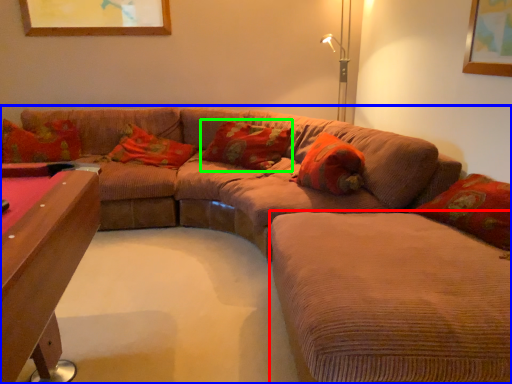
Question: Considering the real-world distances, which object is farthest from couch (highlighted by a red box)? studio couch (highlighted by a blue box) or pillow (highlighted by a green box)?

Choices:
 (A) studio couch
 (B) pillow

Answer: (B)